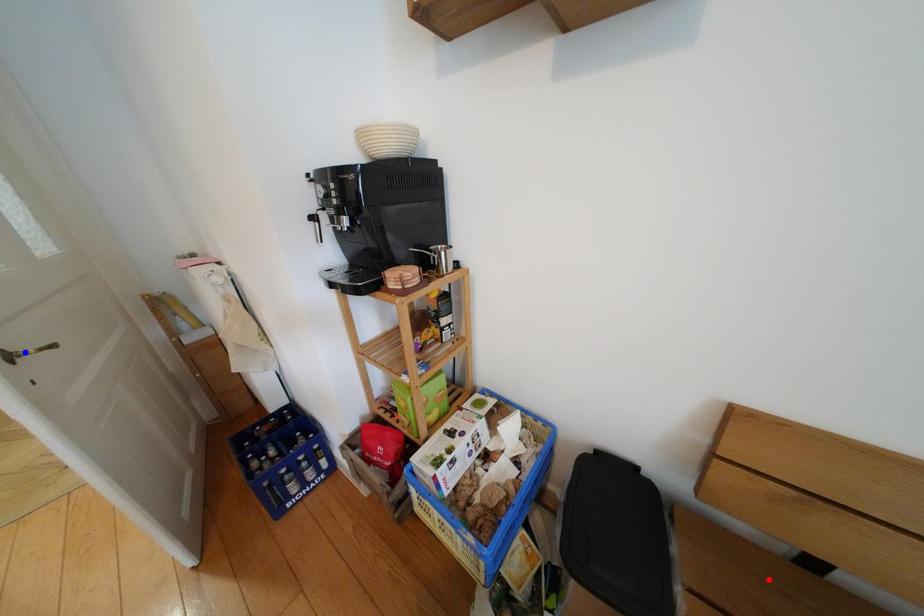
Question: In the image, two points are highlighted. Which point is nearer to the camera? Reply with the corresponding letter.

Choices:
 (A) blue point
 (B) red point

Answer: (B)